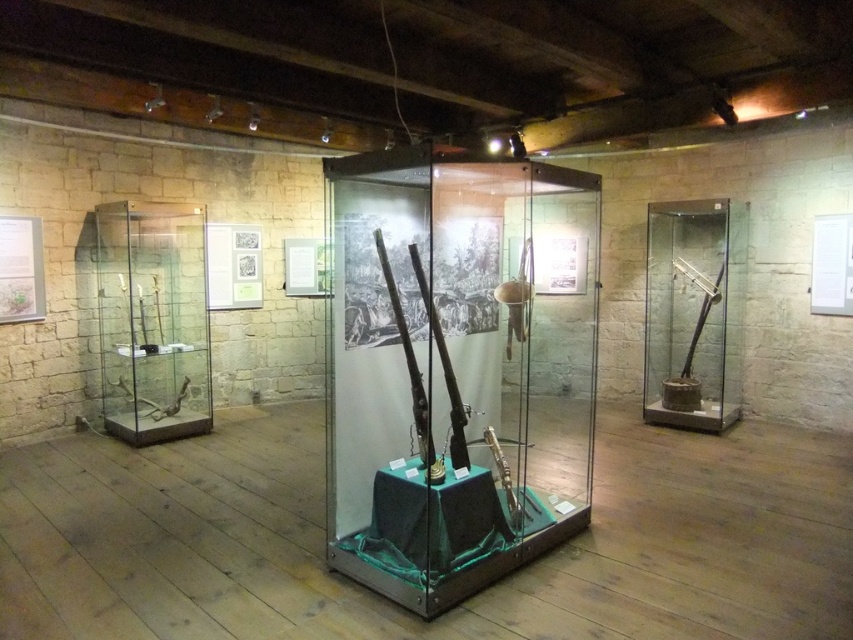
You are standing in the museum and want to take a photo of the glass display case in the center. The camera you are using has a focal length of 50mm and a sensor size of 24mm x 36mm. If the display case is at point (520, 468), which is 5.07 meters away from you, what is the minimum distance you should move forward to ensure the entire display case fits within the camera frame?

The point (520, 468) is 5.07 meters away. To calculate the minimum distance to move forward, use the camera sensor dimensions and focal length. The sensor width is 36mm, and height is 24mm. The display case occupies the center, so assuming it fits within the sensor, the required distance can be calculated using the formula distance_new < sensor_dimension_in_mm_at_center_position divided by focal_length. However, without knowing the actual size of the display case, an exact calculation isn

You are a museum curator who needs to move a new sculpture that is 10 feet wide into the exhibit space. The sculpture must be placed between the clear glass case at center and the matte black rifle at right. Is there enough space to fit the sculpture between them?

The clear glass case at center and the matte black rifle at right are 10.49 feet apart, so the sculpture that is 10 feet wide can fit between them since the distance is slightly larger than the sculpture.